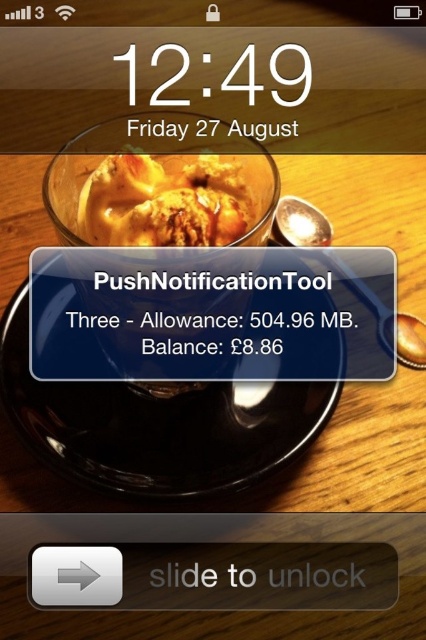
You are a delivery robot with a 2.5 inch wide arm. You need to pick up the golden brown crumbly pastry at upper center and place it onto the black glossy plate at center. Can your arm fit between them without touching either?

The black glossy plate at center is 2.33 inches away from the golden brown crumbly pastry at upper center. Since your arm is 2.5 inches wide, it is slightly wider than the space between them. Therefore, your arm cannot fit without touching either object.

You are arranging a dessert display and need to place the black glossy plate at center and the golden brown crumbly pastry at upper center. According to the scene, which object is positioned to the right side?

The golden brown crumbly pastry at upper center is positioned to the right of the black glossy plate at center.

You are a delivery robot approaching the table where the black glossy plate at center and the golden brown crumbly pastry at upper center are placed. Which object will you reach first as you move towards the table?

The black glossy plate at center will be reached first because it is closer to the viewer than the golden brown crumbly pastry at upper center, meaning it is positioned nearer along the path of approach.